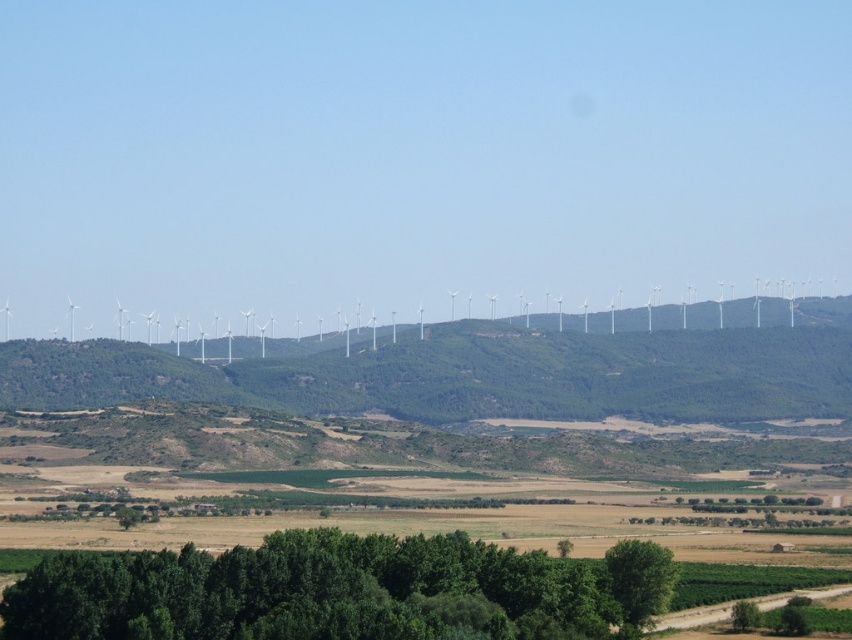
You are a drone operator planning to fly a drone from the white plastic wind turbines at center to the green leafy tree at lower center. What is the approximate distance you need to cover?

The distance between the white plastic wind turbines at center and the green leafy tree at lower center is 254.12 meters, so you need to cover approximately 254 meters.

From the picture: You are standing at the center of the landscape and want to locate the green leafy trees at lower center. According to the coordinates provided, in which direction should you look to find them?

The green leafy trees at lower center are located at coordinates point (x=337, y=589), so you should look downward and slightly to the right to find them.

You are standing at the base of a wind turbine and see two points marked in the landscape, one at point coordinates [734,307] and the other at point coordinates [657,611]. Which point is closer to you?

Point coordinates [657,611] is closer to you because it is less far from the camera than point coordinates [734,307].